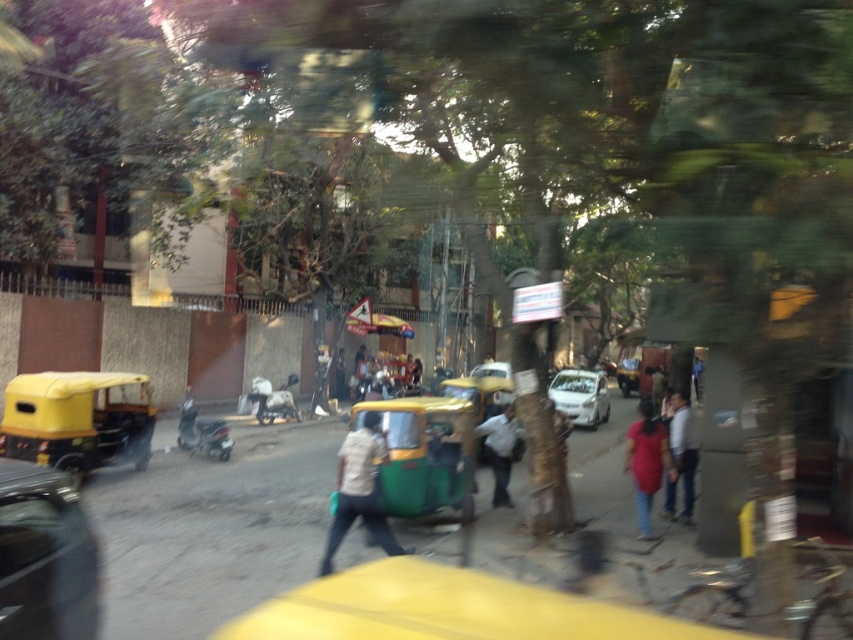
Which is above, yellow matte auto-rickshaw at center or metallic silver car at center?

Positioned higher is yellow matte auto-rickshaw at center.

Image resolution: width=853 pixels, height=640 pixels. Describe the element at coordinates (482, 388) in the screenshot. I see `yellow matte auto-rickshaw at center` at that location.

The image size is (853, 640). I want to click on yellow matte auto-rickshaw at center, so click(482, 388).

Is light brown fabric shirt at center to the right of light blue jeans at center from the viewer's perspective?

No, light brown fabric shirt at center is not to the right of light blue jeans at center.

Based on the photo, does light brown fabric shirt at center appear over light blue jeans at center?

Actually, light brown fabric shirt at center is below light blue jeans at center.

At what (x,y) coordinates should I click in order to perform the action: click on light brown fabric shirt at center. Please return your answer as a coordinate pair (x, y). The height and width of the screenshot is (640, 853). Looking at the image, I should click on (358, 490).

Where is `light brown fabric shirt at center`? The width and height of the screenshot is (853, 640). light brown fabric shirt at center is located at coordinates (358, 490).

Which is below, matte red shirt at center or white cotton shirt at center?

matte red shirt at center is lower down.

Can you confirm if matte red shirt at center is positioned to the left of white cotton shirt at center?

Incorrect, matte red shirt at center is not on the left side of white cotton shirt at center.

In order to click on matte red shirt at center in this screenshot , I will do pyautogui.click(x=646, y=461).

Identify the location of matte red shirt at center. This screenshot has width=853, height=640. (646, 461).